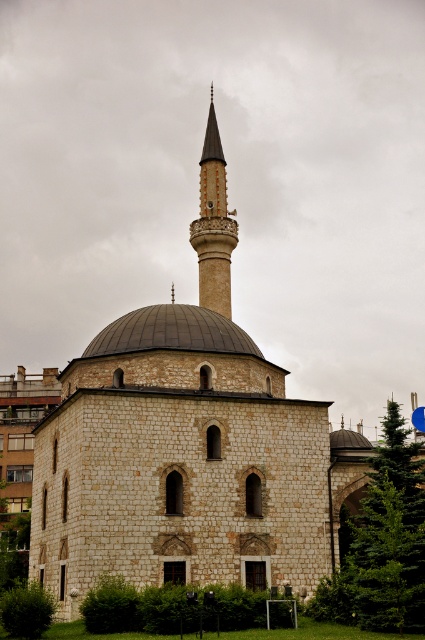
Question: Which of the following is the closest to the observer?

Choices:
 (A) dark gray stone dome at center
 (B) smooth beige minaret at upper center

Answer: (A)

Question: Is dark gray stone dome at center smaller than smooth beige minaret at upper center?

Choices:
 (A) no
 (B) yes

Answer: (B)

Question: Can you confirm if dark gray stone dome at center is positioned to the left of smooth beige minaret at upper center?

Choices:
 (A) no
 (B) yes

Answer: (B)

Question: Is dark gray stone dome at center positioned in front of smooth beige minaret at upper center?

Choices:
 (A) no
 (B) yes

Answer: (B)